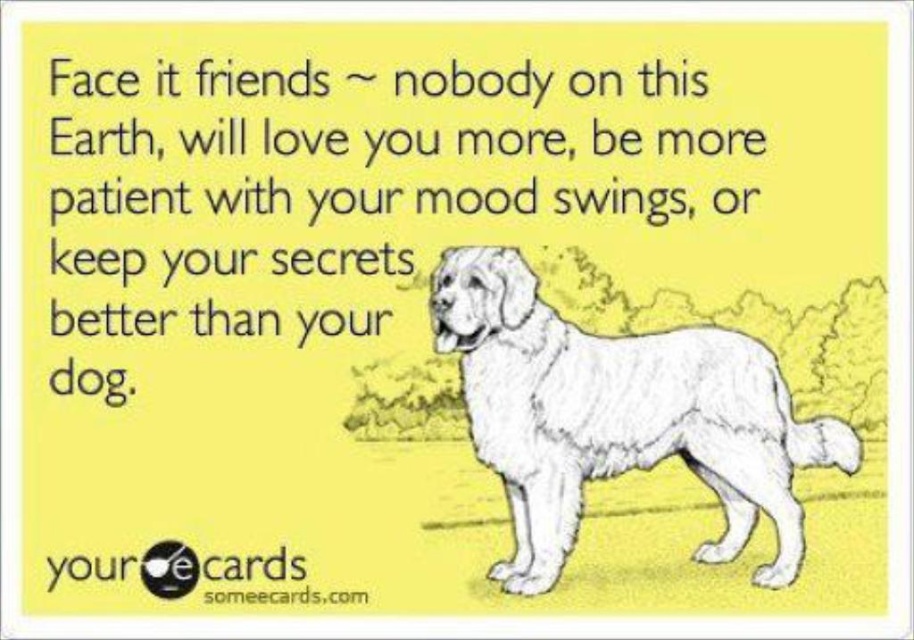
You are an AI that needs to locate the white fluffy dog at right in the image. What are its coordinates?

The white fluffy dog at right is located at coordinates [619,417].